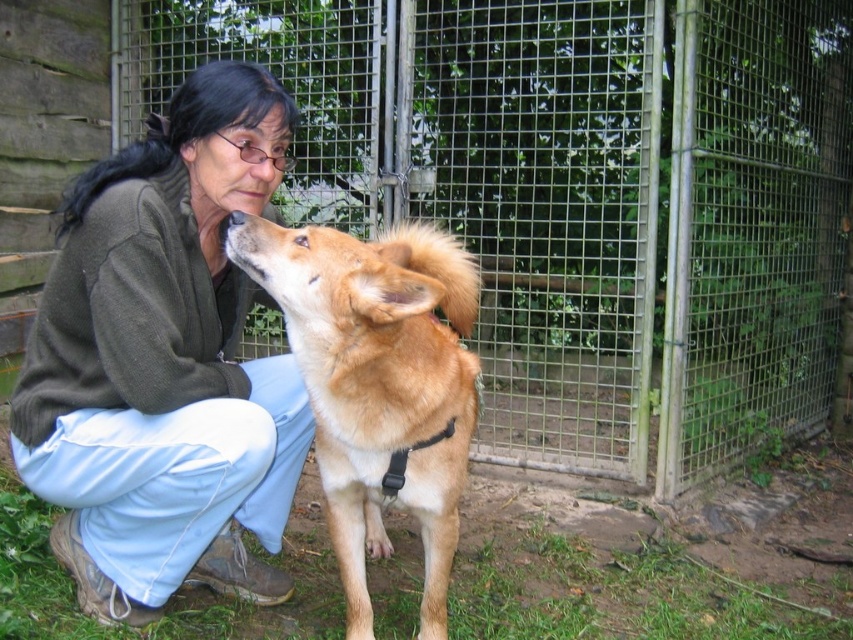
You are a delivery robot that is 1.2 meters wide. You are in a fenced area and need to move between the woman and the dog. The woman is at point (523, 28). Can you fit through the space between them?

The distance between the woman and the dog is 3.73 meters. Since the robot is 1.2 meters wide, there is enough space for the robot to pass through the gap between them.

From the picture: You are a photographer trying to capture a clear photo of the green wire mesh fence at center and the matte green sweater at center. Which object is closer to the camera lens?

The green wire mesh fence at center is positioned over matte green sweater at center, so the green wire mesh fence at center is closer to the camera lens.

You are a visitor at an animal shelter and see the woman and the dog through the green wire mesh fence at center. You notice she is wearing the matte green sweater at center. Is the sweater closer to you or behind the fence?

The matte green sweater at center is behind the green wire mesh fence at center, so the sweater is behind the fence.